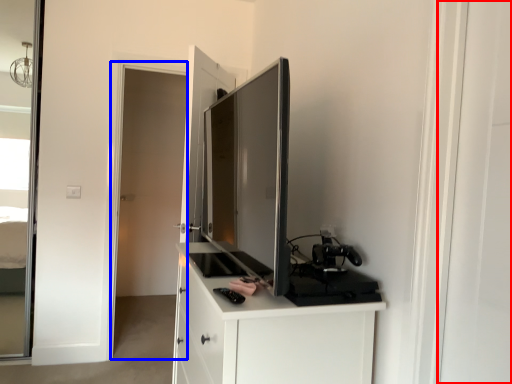
Question: Among these objects, which one is nearest to the camera, screen door (highlighted by a red box) or screen door (highlighted by a blue box)?

Choices:
 (A) screen door
 (B) screen door

Answer: (A)